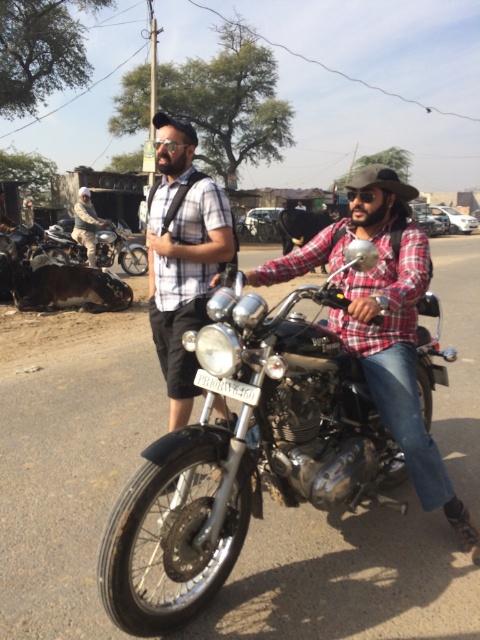
You are a delivery person who needs to park your 2.5 meters wide delivery van next to the shiny chrome motorcycle at center and the plaid shirt at center. Can you park your van without overlapping either of them?

The shiny chrome motorcycle at center is wider than the plaid shirt at center. Since the van is 2.5 meters wide, you need to ensure there is enough space between the motorcycle and the shirt to accommodate the van without overlapping. However, without knowing the exact distance between the two objects, it is impossible to determine if the van can be parked safely.

You are standing at the point labeled point (196, 448) and want to walk to the point labeled point (402, 257). Which direction should you face to move towards your destination?

You should face towards the direction of point (402, 257), which is further away from the viewer compared to your current position at point (196, 448).